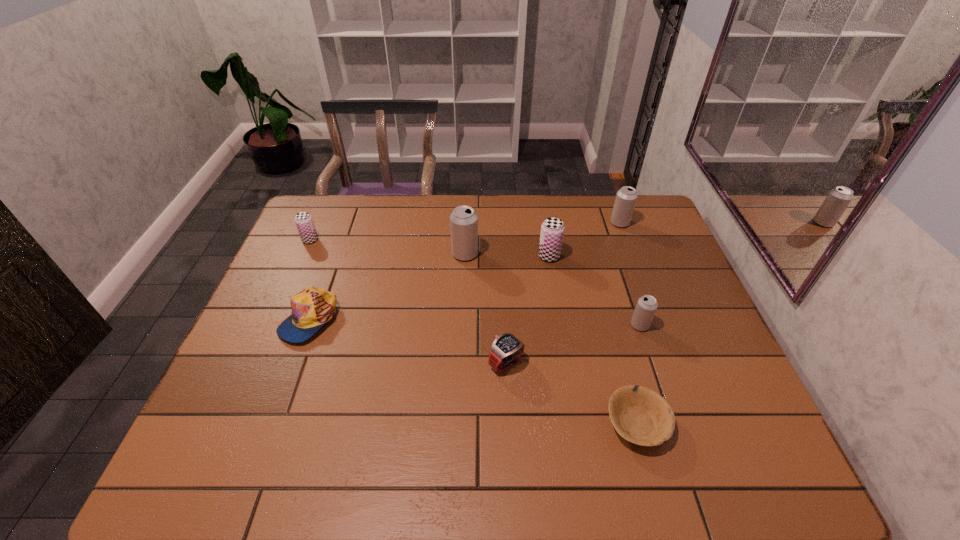
Find the location of a particular element. the sixth object from right to left is located at coordinates (463, 220).

Identify the location of the tallest object. The image size is (960, 540). (463, 220).

In order to click on the fourth object from right to left in this screenshot , I will do `click(552, 229)`.

Locate an element on the screen. the nearer purple beer can is located at coordinates (552, 229).

This screenshot has width=960, height=540. What are the coordinates of `the farthest object` in the screenshot? It's located at (626, 197).

This screenshot has width=960, height=540. What are the coordinates of `the farthest white beer can` in the screenshot? It's located at (626, 197).

Where is `the second farthest beer can`? the second farthest beer can is located at coordinates (303, 220).

Locate an element on the screen. Image resolution: width=960 pixels, height=540 pixels. the second farthest object is located at coordinates (303, 220).

Where is `the smallest white beer can`? This screenshot has width=960, height=540. the smallest white beer can is located at coordinates (646, 307).

In order to click on the nearest beer can in this screenshot , I will do `click(646, 307)`.